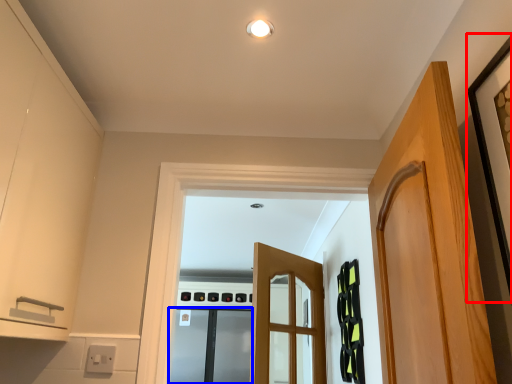
Question: Which object is further to the camera taking this photo, picture frame (highlighted by a red box) or screen door (highlighted by a blue box)?

Choices:
 (A) picture frame
 (B) screen door

Answer: (B)